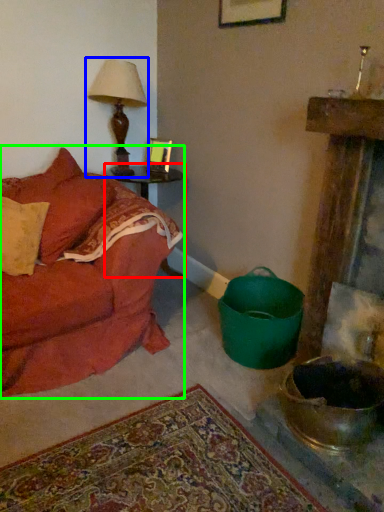
Question: Which object is the farthest from table (highlighted by a red box)? Choose among these: table lamp (highlighted by a blue box) or studio couch (highlighted by a green box).

Choices:
 (A) table lamp
 (B) studio couch

Answer: (B)